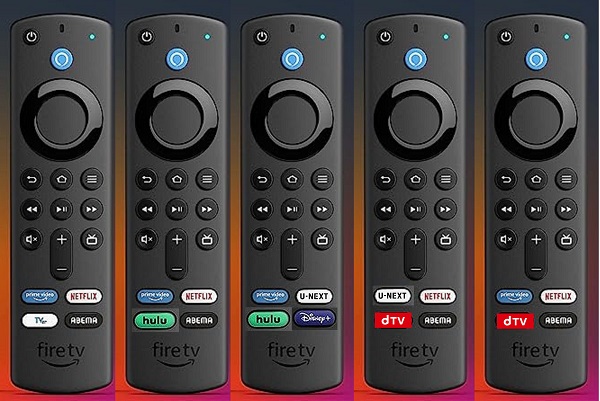
At what (x,y) coordinates should I click in order to perform the action: click on fire tv remote. Please return your answer as a coordinate pair (x, y). The width and height of the screenshot is (600, 401). Looking at the image, I should click on (93, 77), (167, 72), (264, 94), (403, 86), (514, 103).